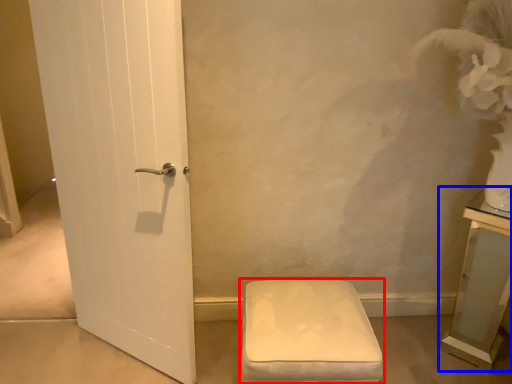
Question: Among these objects, which one is nearest to the camera, furniture (highlighted by a red box) or vanity (highlighted by a blue box)?

Choices:
 (A) furniture
 (B) vanity

Answer: (A)